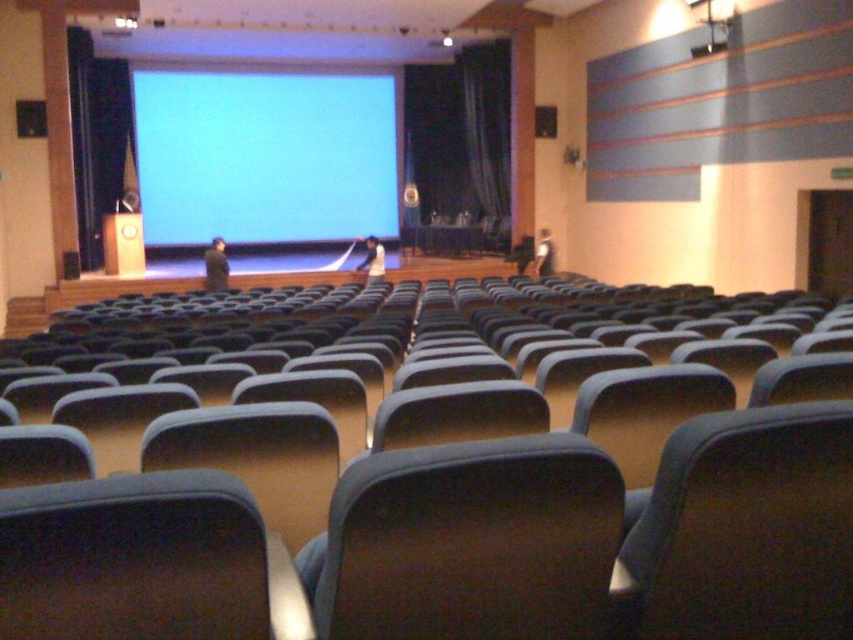
You are sitting in the front row of the auditorium and want to see both the blue matte projection screen at center and the blue fabric curtain at center. Which one appears closer to you?

The blue matte projection screen at center appears closer to you because it is positioned further to the viewer than the blue fabric curtain at center.

In the scene shown: You are organizing a small event in the auditorium and need to place a 1.5 meter wide table between the dark fabric chair at lower right and the blue matte projection screen at center. Can the table fit in the space between them?

The dark fabric chair at lower right has a lesser width compared to blue matte projection screen at center. Since the table is 1.5 meters wide, it is possible that the space between them is sufficient, but the exact width of the chair and screen is needed to confirm.

You are sitting in the auditorium and need to move to the stage. There is a dark fabric chair at lower right. Can you walk directly towards the stage from your current position without moving around any chairs?

The dark fabric chair at lower right is located at point (x=743, y=531), which is near the edge of the seating area. Since the chairs are arranged in rows facing the stage, you would need to walk around the chairs in your row to reach the stage. Therefore, you cannot walk directly towards the stage without moving around any chairs.